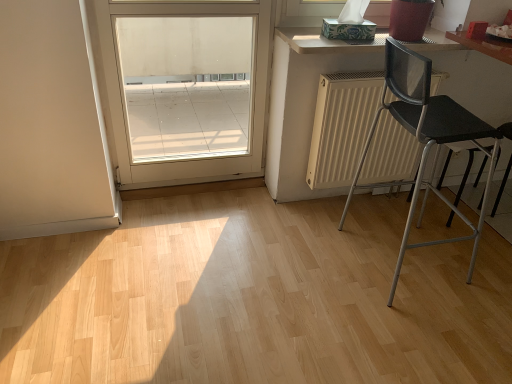
Locate an element on the screen. The image size is (512, 384). vacant space in front of black mesh chair at right is located at coordinates (419, 333).